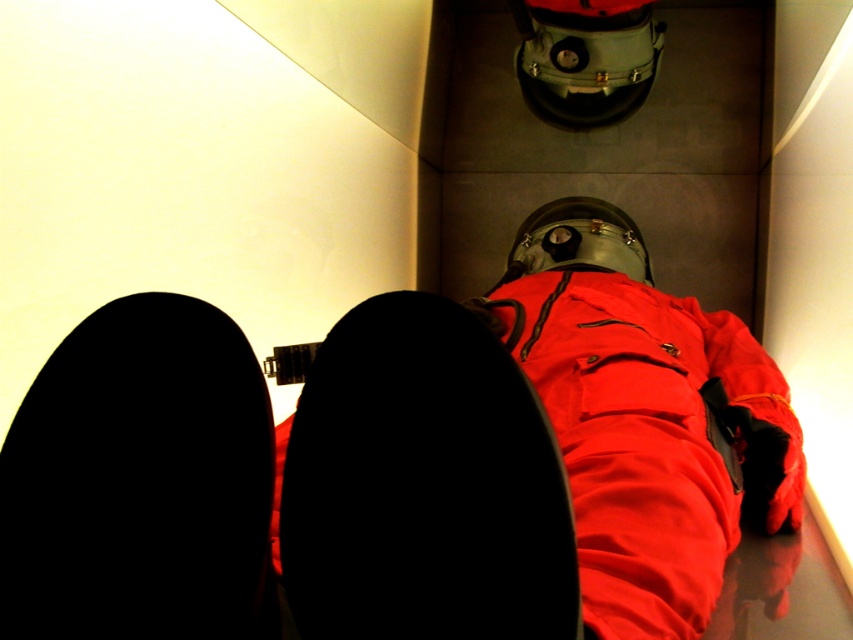
Does matte red spacesuit at center appear under matte red jacket at center?

Actually, matte red spacesuit at center is above matte red jacket at center.

Who is more distant from viewer, (117,532) or (579,534)?

The point (579,534) is behind.

Where is `matte red spacesuit at center`? Image resolution: width=853 pixels, height=640 pixels. matte red spacesuit at center is located at coordinates (519, 458).

Can you confirm if matte red spacesuit at center is taller than black matte shoe at lower left?

Indeed, matte red spacesuit at center has a greater height compared to black matte shoe at lower left.

Is matte red spacesuit at center to the left of black matte shoe at lower left from the viewer's perspective?

Incorrect, matte red spacesuit at center is not on the left side of black matte shoe at lower left.

Where is `matte red spacesuit at center`? The image size is (853, 640). matte red spacesuit at center is located at coordinates tap(519, 458).

Is black matte boot at lower center smaller than matte red jacket at center?

Yes.

Is point (502, 468) closer to viewer compared to point (680, 452)?

Yes, point (502, 468) is closer to viewer.

Where is `black matte boot at lower center`? black matte boot at lower center is located at coordinates (422, 484).